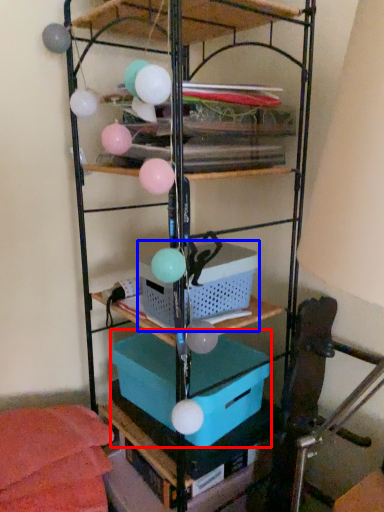
Question: Which point is closer to the camera, box (highlighted by a red box) or basket (highlighted by a blue box)?

Choices:
 (A) box
 (B) basket

Answer: (B)